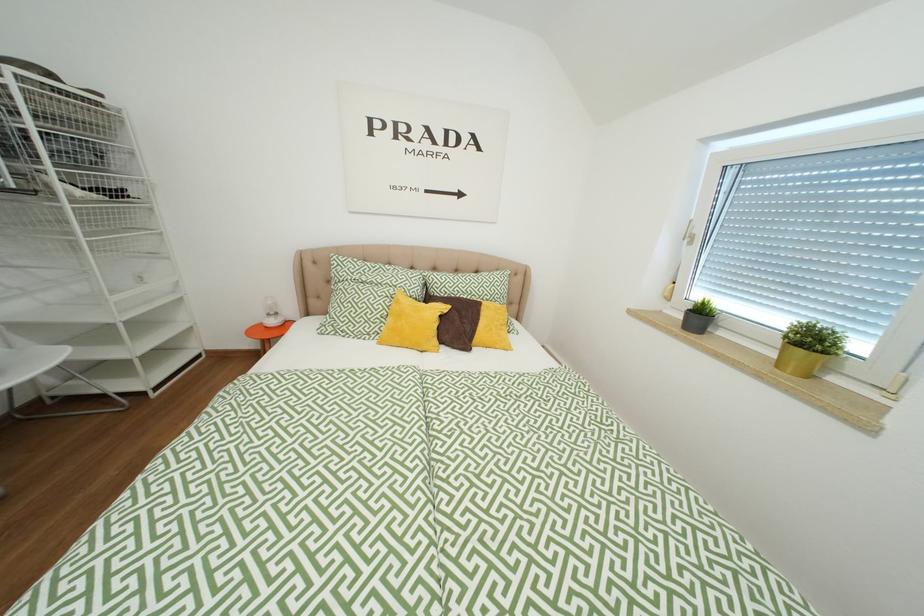
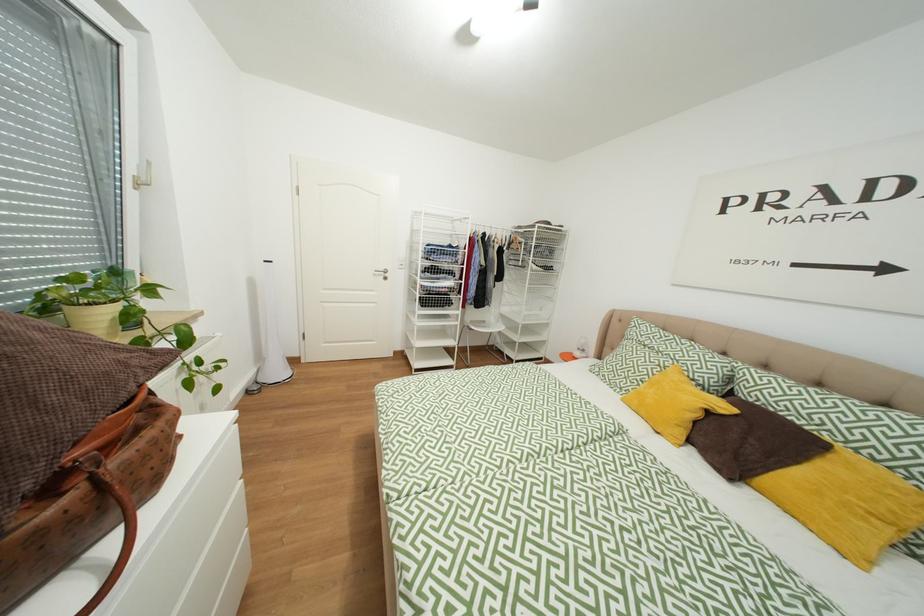
Question: How did the camera likely rotate?

Choices:
 (A) Left
 (B) Right
 (C) Up
 (D) Down

Answer: (A)